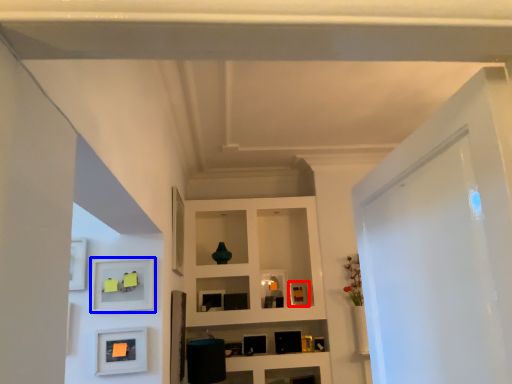
Question: Which object appears closest to the camera in this image, picture frame (highlighted by a red box) or shelf (highlighted by a blue box)?

Choices:
 (A) picture frame
 (B) shelf

Answer: (B)